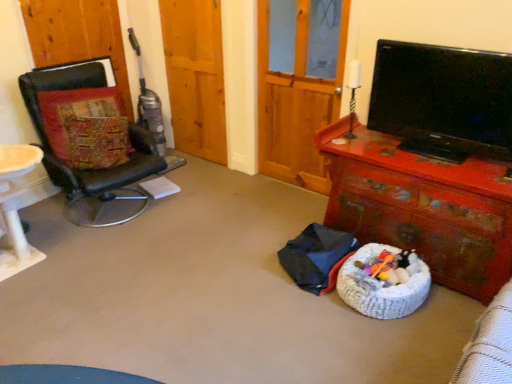
Locate an element on the screen. free space in front of dark blue fabric at center is located at coordinates (310, 319).